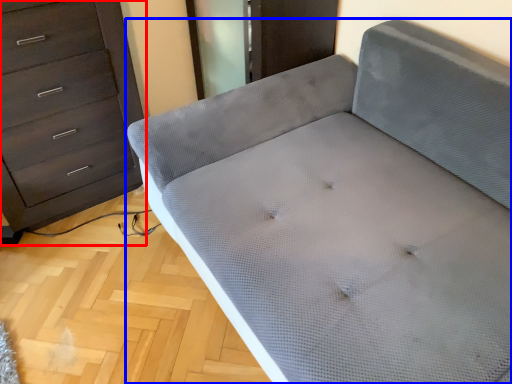
Question: Which point is closer to the camera, chest of drawers (highlighted by a red box) or furniture (highlighted by a blue box)?

Choices:
 (A) chest of drawers
 (B) furniture

Answer: (B)